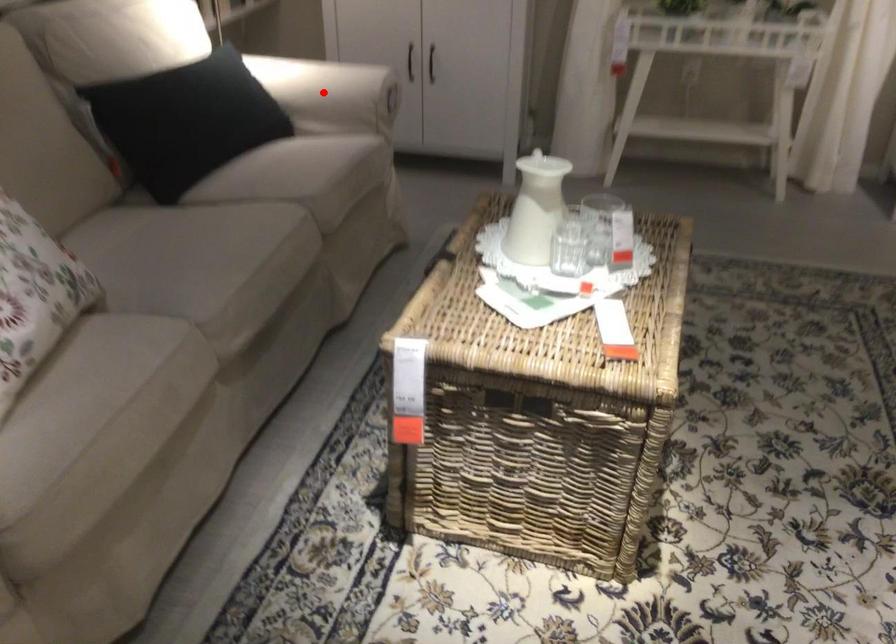
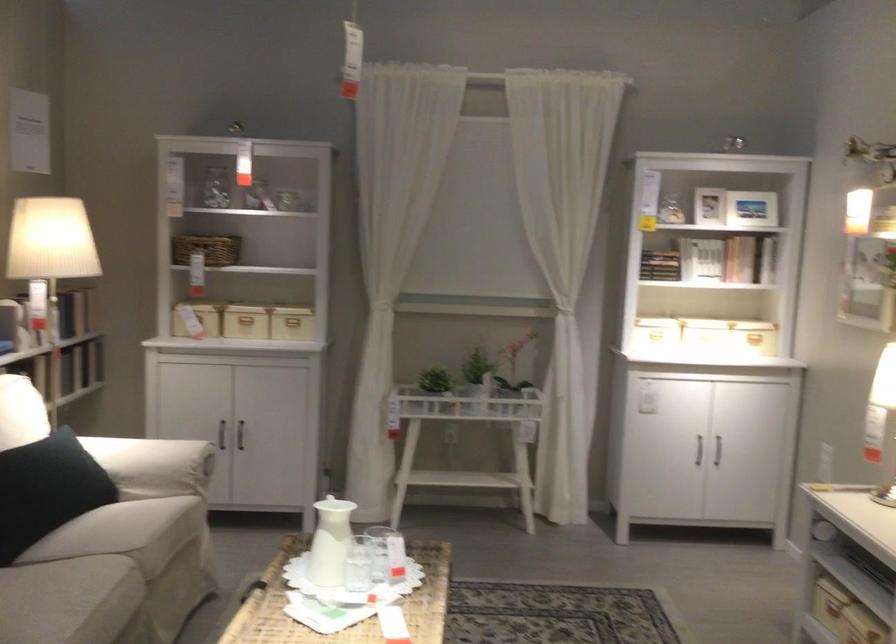
Question: I am providing you with two images of the same scene from different viewpoints. Given a red point in image1, look at the same physical point in image2. Is it:

Choices:
 (A) Closer to the viewpoint
 (B) Farther from the viewpoint

Answer: (B)